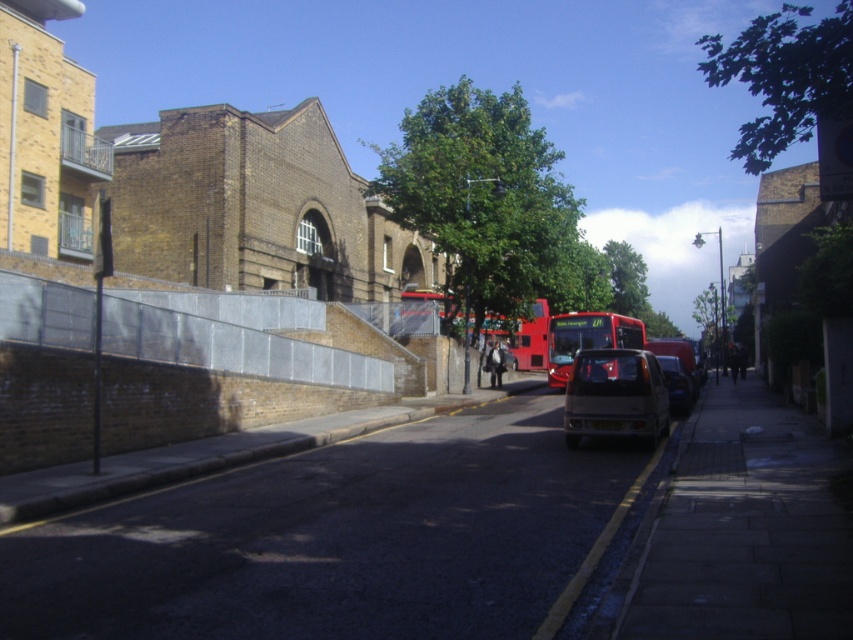
Can you confirm if matte silver hatchback at center is positioned to the left of matte silver van at center?

Correct, you'll find matte silver hatchback at center to the left of matte silver van at center.

Can you confirm if matte silver hatchback at center is thinner than matte silver van at center?

No.

Does point (648, 371) come farther from viewer compared to point (682, 412)?

No, (648, 371) is in front of (682, 412).

Locate an element on the screen. matte silver hatchback at center is located at coordinates (614, 396).